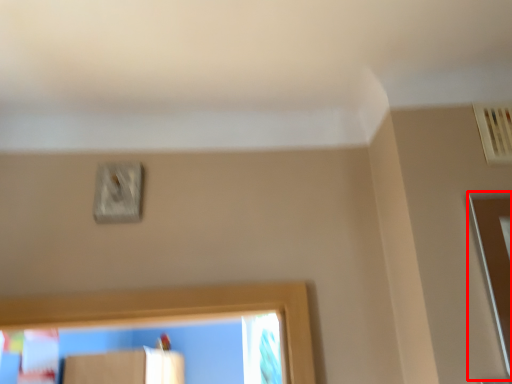
Question: From the image, what is the correct spatial relationship of screen door (annotated by the red box) in relation to light switch?

Choices:
 (A) right
 (B) left

Answer: (A)